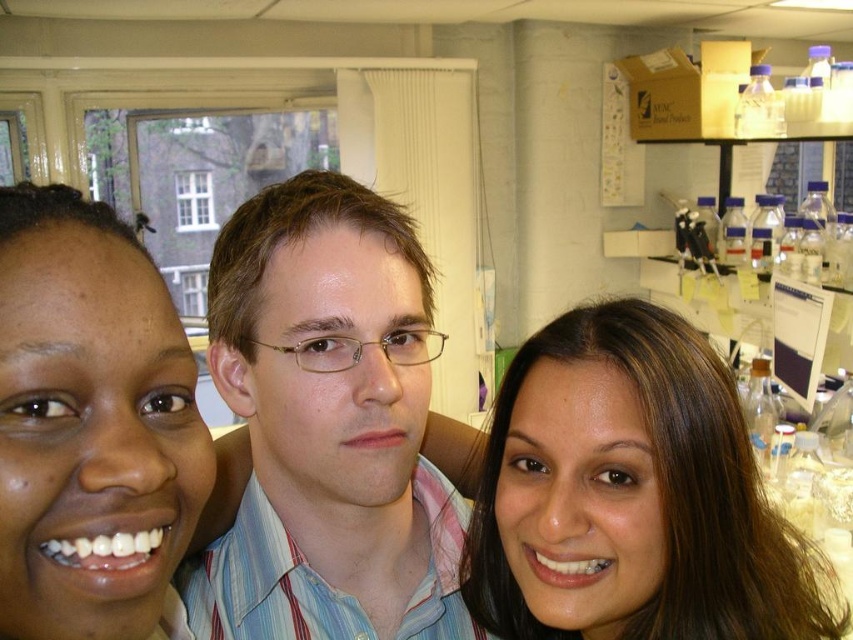
Question: Which of the following is the closest to the observer?

Choices:
 (A) smooth skin face at left
 (B) light blue striped shirt at center

Answer: (A)

Question: Is light blue striped shirt at center above smooth skin face at left?

Choices:
 (A) yes
 (B) no

Answer: (B)

Question: Which is nearer to the light blue striped shirt at center?

Choices:
 (A) smooth skin face at left
 (B) brown hair at upper right

Answer: (B)

Question: Based on their relative distances, which object is farther from the brown hair at upper right?

Choices:
 (A) smooth skin face at left
 (B) light blue striped shirt at center

Answer: (A)

Question: Is brown hair at upper right above smooth skin face at left?

Choices:
 (A) no
 (B) yes

Answer: (A)

Question: Is brown hair at upper right bigger than smooth skin face at left?

Choices:
 (A) no
 (B) yes

Answer: (B)